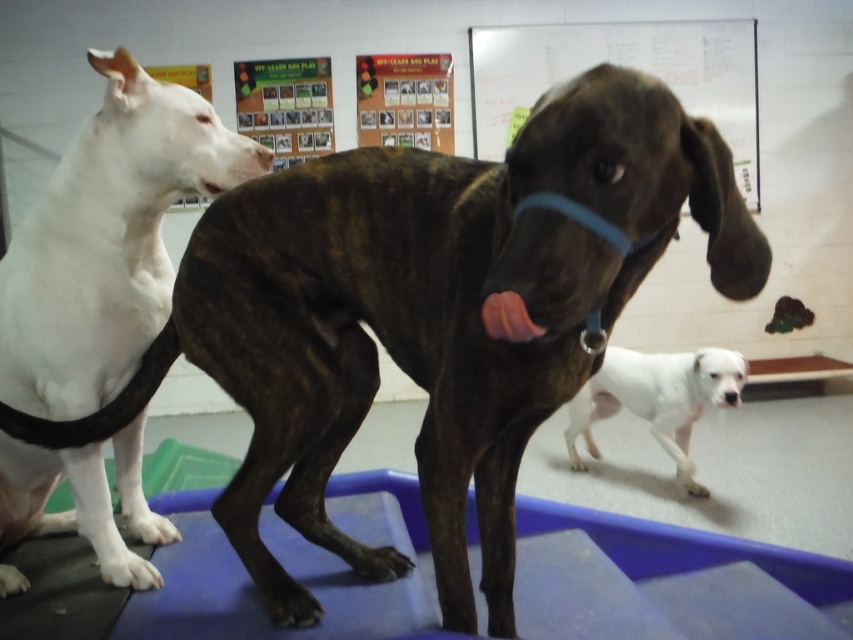
Can you confirm if white smooth dog at left is positioned to the left of whiteboard at upper center?

Yes, white smooth dog at left is to the left of whiteboard at upper center.

Between white smooth dog at left and whiteboard at upper center, which one has more height?

Standing taller between the two is whiteboard at upper center.

I want to click on white smooth dog at left, so click(x=107, y=241).

Is whiteboard at upper center taller than white smooth dog at lower right?

Yes, whiteboard at upper center is taller than white smooth dog at lower right.

Between whiteboard at upper center and white smooth dog at lower right, which one appears on the right side from the viewer's perspective?

whiteboard at upper center

Identify the location of whiteboard at upper center. This screenshot has height=640, width=853. (621, 65).

Find the location of a particular element. The image size is (853, 640). whiteboard at upper center is located at coordinates (621, 65).

Can you confirm if white smooth dog at left is positioned below white smooth dog at lower right?

Actually, white smooth dog at left is above white smooth dog at lower right.

Can you confirm if white smooth dog at left is positioned to the left of white smooth dog at lower right?

Correct, you'll find white smooth dog at left to the left of white smooth dog at lower right.

What do you see at coordinates (107, 241) in the screenshot? I see `white smooth dog at left` at bounding box center [107, 241].

At what (x,y) coordinates should I click in order to perform the action: click on white smooth dog at left. Please return your answer as a coordinate pair (x, y). The height and width of the screenshot is (640, 853). Looking at the image, I should click on (107, 241).